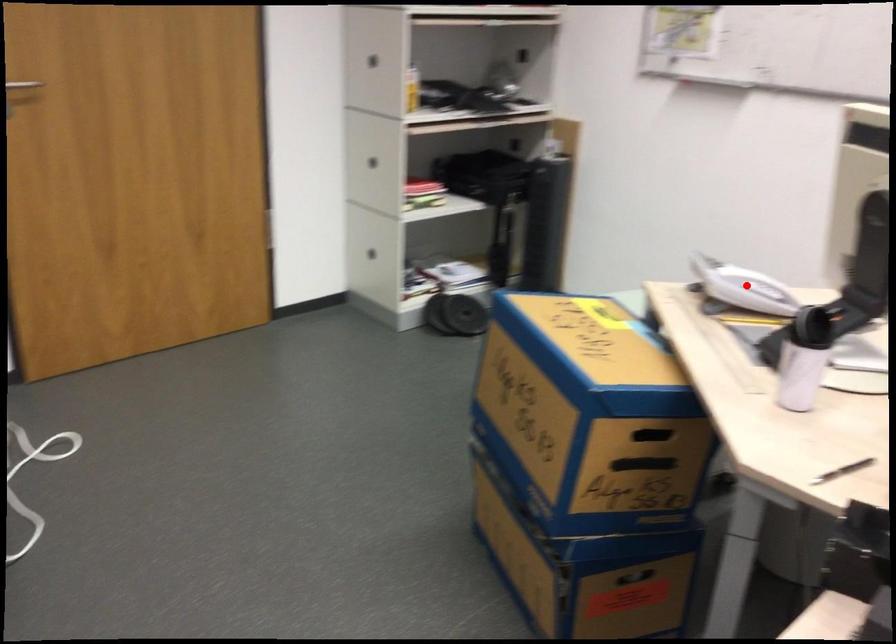
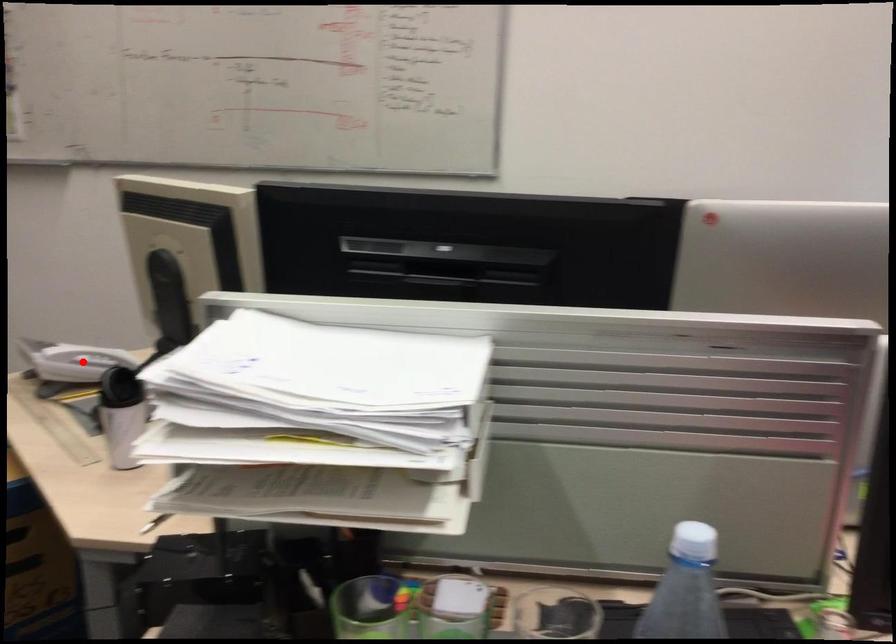
I am providing you with two images of the same scene from different viewpoints. A red point is marked on the first image and another point is marked on the second image. Do the highlighted points in image1 and image2 indicate the same real-world spot?

Yes